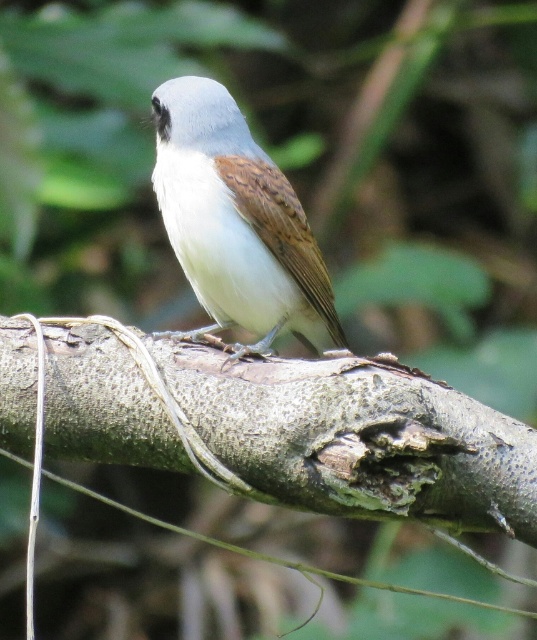
Question: Which object appears farthest from the camera in this image?

Choices:
 (A) rough bark branch at center
 (B) white matte bird at center

Answer: (B)

Question: Which object is closer to the camera taking this photo?

Choices:
 (A) white matte bird at center
 (B) rough bark branch at center

Answer: (B)

Question: Is rough bark branch at center positioned at the back of white matte bird at center?

Choices:
 (A) no
 (B) yes

Answer: (A)

Question: Considering the relative positions of rough bark branch at center and white matte bird at center in the image provided, where is rough bark branch at center located with respect to white matte bird at center?

Choices:
 (A) above
 (B) below

Answer: (B)

Question: Is rough bark branch at center in front of white matte bird at center?

Choices:
 (A) yes
 (B) no

Answer: (A)